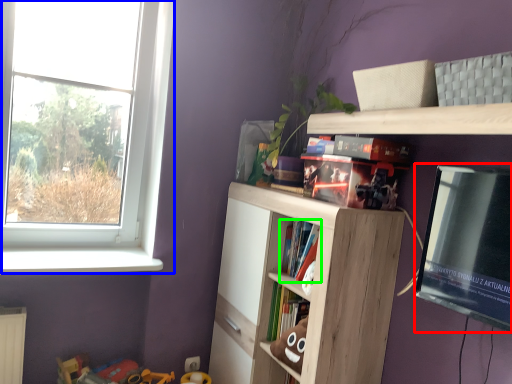
Question: Which is farther away from window screen (highlighted by a red box)? window (highlighted by a blue box) or book (highlighted by a green box)?

Choices:
 (A) window
 (B) book

Answer: (A)